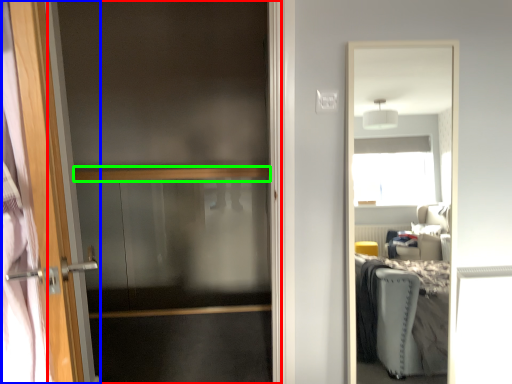
Question: Considering the real-world distances, which object is closest to screen door (highlighted by a red box)? door (highlighted by a blue box) or balustrade (highlighted by a green box).

Choices:
 (A) door
 (B) balustrade

Answer: (B)